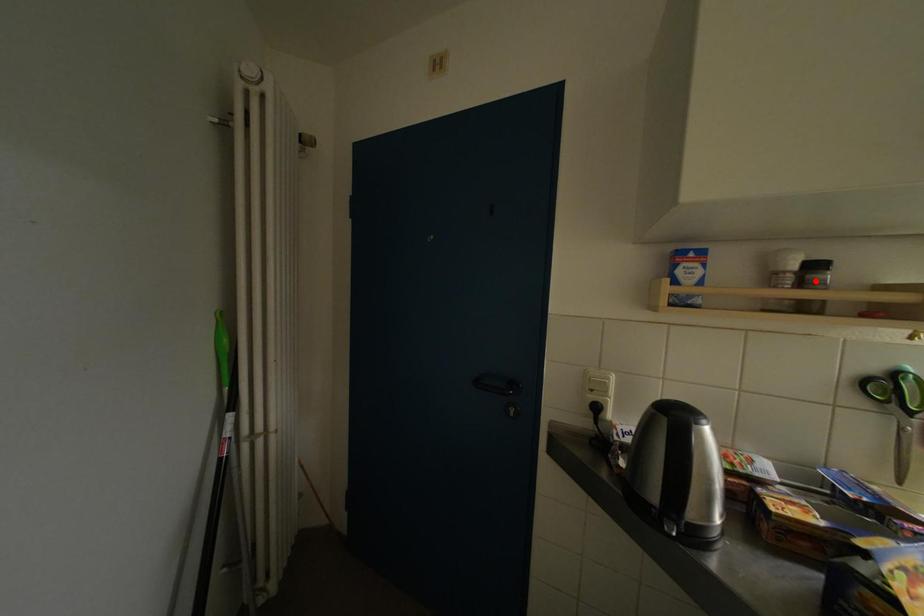
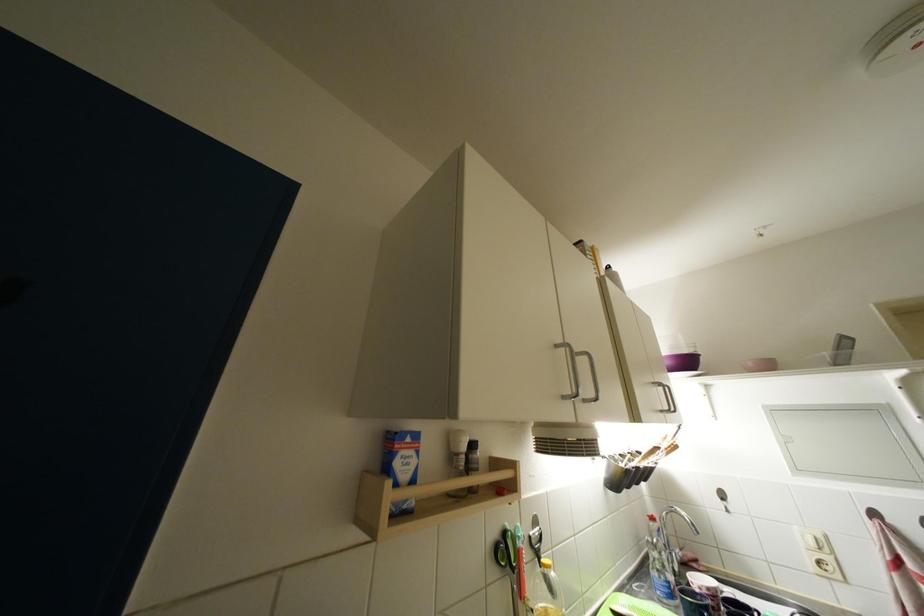
Locate, in the second image, the point that corresponds to the highlighted location in the first image.

(478, 460)